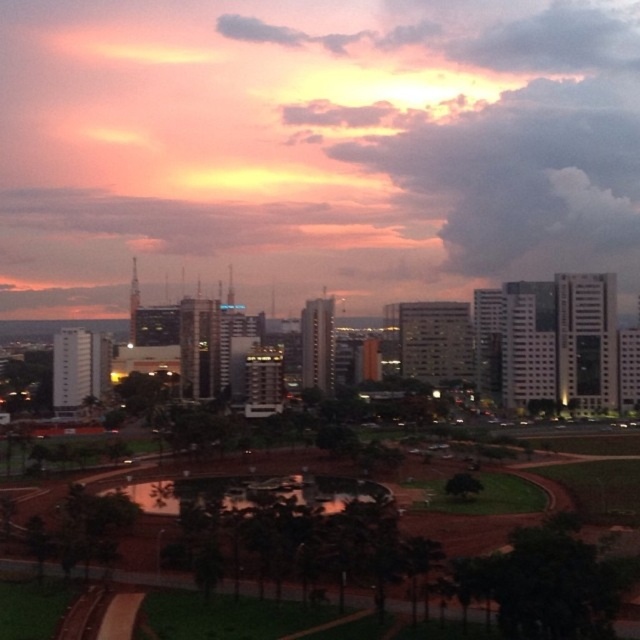
Question: Which of the following is the closest to the observer?

Choices:
 (A) green grass at center
 (B) matte orange sky at upper center

Answer: (A)

Question: Is matte orange sky at upper center positioned before green grass at center?

Choices:
 (A) no
 (B) yes

Answer: (A)

Question: Is matte orange sky at upper center above green grass at center?

Choices:
 (A) no
 (B) yes

Answer: (B)

Question: Where is matte orange sky at upper center located in relation to green grass at center in the image?

Choices:
 (A) below
 (B) above

Answer: (B)